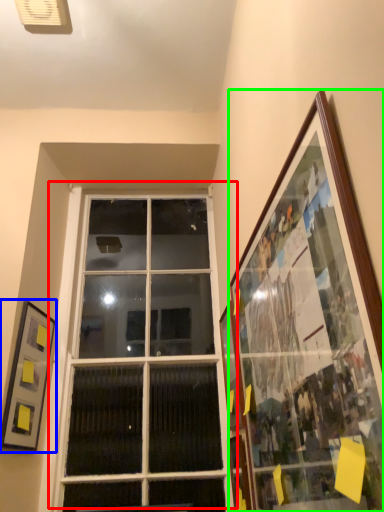
Question: Which is farther away from window (highlighted by a red box)? picture frame (highlighted by a blue box) or picture frame (highlighted by a green box)?

Choices:
 (A) picture frame
 (B) picture frame

Answer: (B)